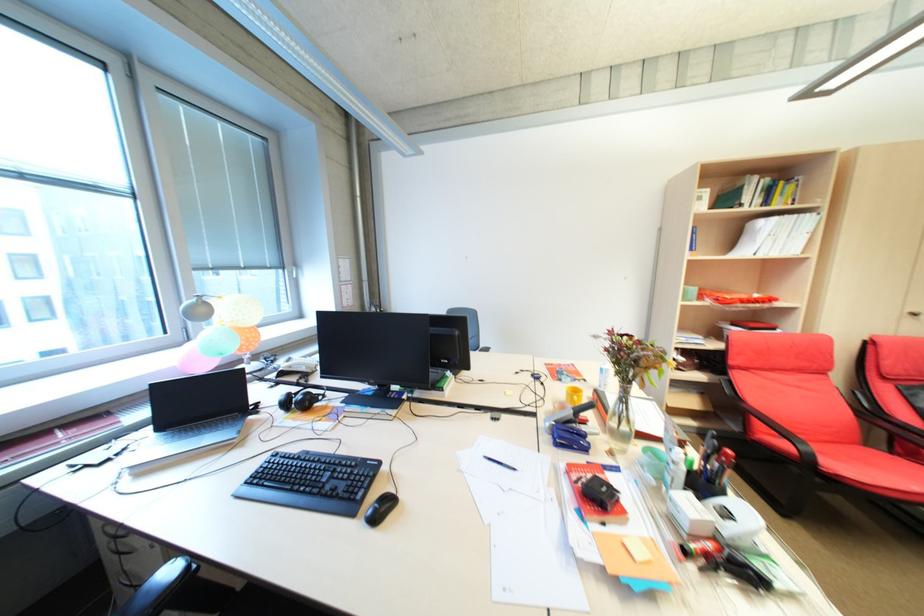
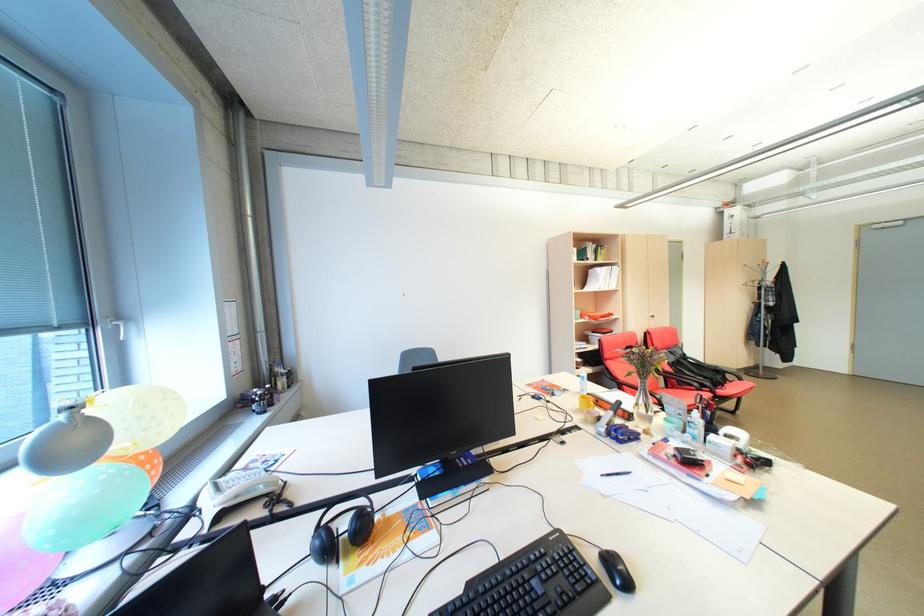
Where in the second image is the point corresponding to point 509,464 from the first image?

(627, 475)